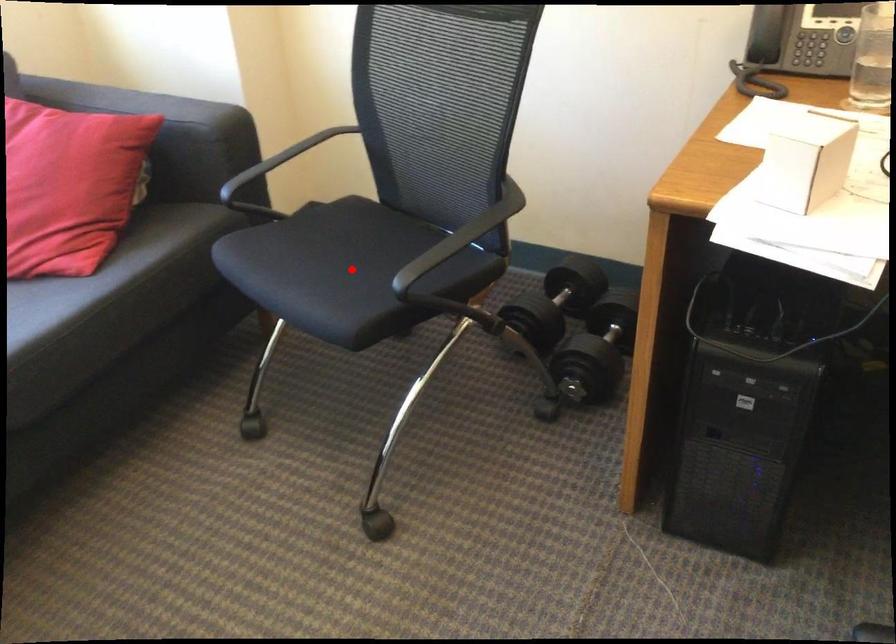
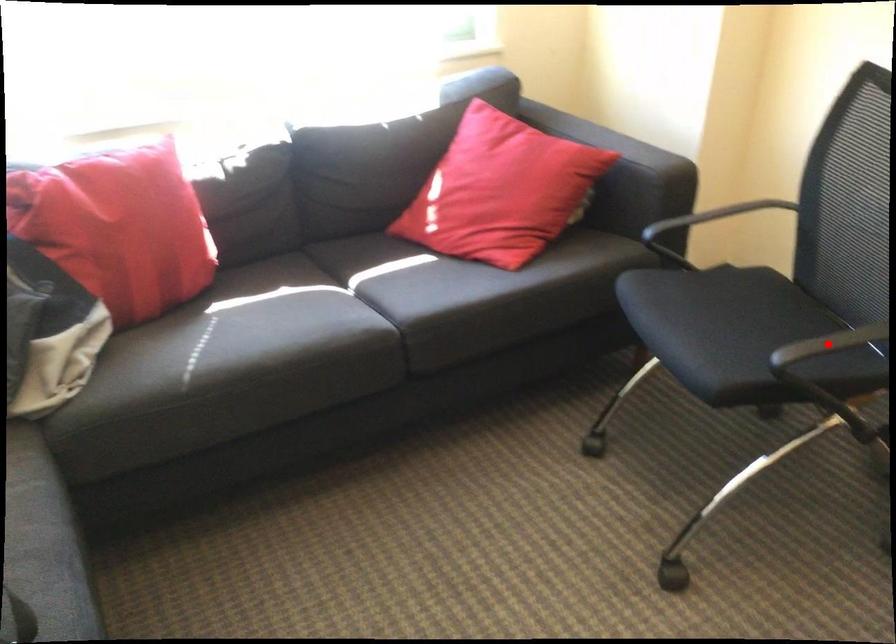
I am providing you with two images of the same scene from different viewpoints. A red point is marked on the first image and another point is marked on the second image. Are the points marked in image1 and image2 representing the same 3D position?

No